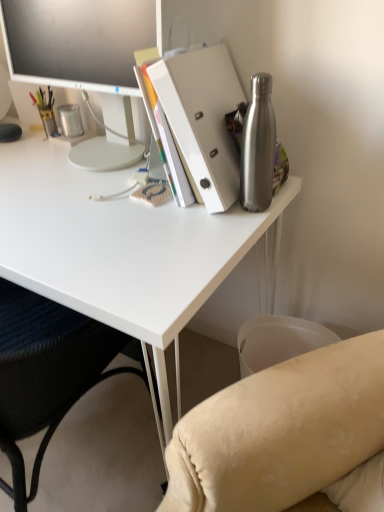
Image resolution: width=384 pixels, height=512 pixels. I want to click on vacant space underneath white glossy monitor at upper left (from a real-world perspective), so click(x=99, y=154).